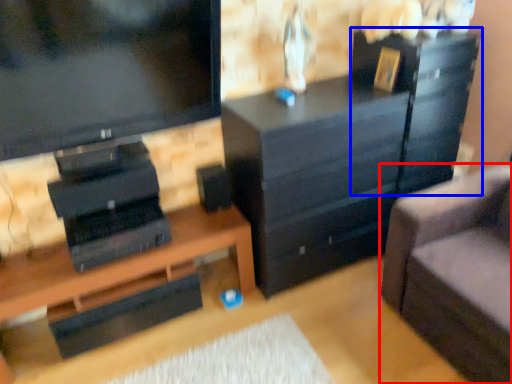
Question: Which object appears closest to the camera in this image, studio couch (highlighted by a red box) or file cabinet (highlighted by a blue box)?

Choices:
 (A) studio couch
 (B) file cabinet

Answer: (A)